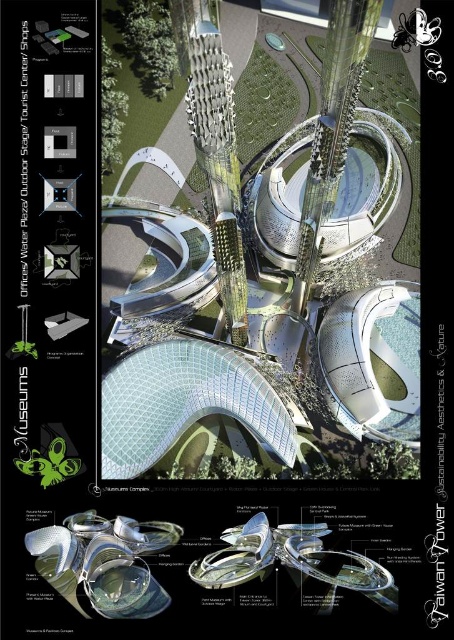
Where is `sleek silver tower at center`? The height and width of the screenshot is (640, 454). sleek silver tower at center is located at coordinates (217, 152).

Is point (220, 147) positioned after point (59, 481)?

No, (220, 147) is in front of (59, 481).

Between point (216, 268) and point (34, 460), which one is positioned behind?

Point (216, 268)

Identify the location of sleek silver tower at center. (217, 152).